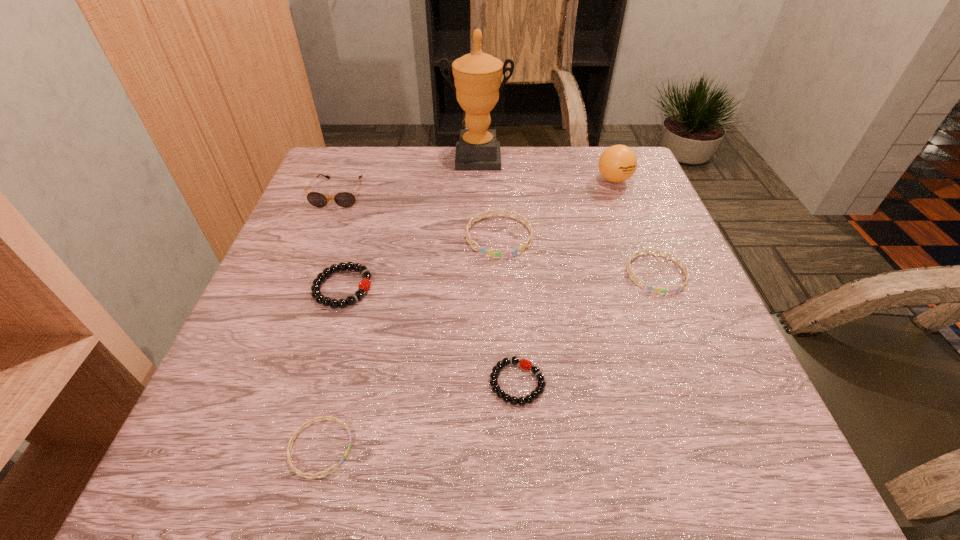
Locate an element on the screen. The width and height of the screenshot is (960, 540). vacant area between the bigger black bracelet and the tallest object is located at coordinates (410, 223).

Where is `empty space that is in between the second blue bracelet from left to right and the fourth farthest bracelet`? The width and height of the screenshot is (960, 540). empty space that is in between the second blue bracelet from left to right and the fourth farthest bracelet is located at coordinates (508, 309).

The height and width of the screenshot is (540, 960). What are the coordinates of `free space between the bigger black bracelet and the ping-pong ball` in the screenshot? It's located at (478, 234).

Locate an element on the screen. vacant point located between the right black bracelet and the black sunglasses is located at coordinates (428, 288).

Image resolution: width=960 pixels, height=540 pixels. What are the coordinates of `vacant space that is in between the second blue bracelet from left to right and the ping-pong ball` in the screenshot? It's located at (557, 208).

This screenshot has width=960, height=540. What are the coordinates of `vacant space that's between the nearer black bracelet and the nearest object` in the screenshot? It's located at (419, 415).

Locate an element on the screen. vacant area between the second blue bracelet from right to left and the sixth shortest object is located at coordinates point(420,214).

What are the coordinates of `free space between the smaller black bracelet and the second blue bracelet from right to left` in the screenshot? It's located at (508, 309).

The image size is (960, 540). What are the coordinates of `empty location between the seventh shortest object and the black sunglasses` in the screenshot? It's located at (476, 186).

Identify which object is the sixth nearest to the golden award. Please provide its 2D coordinates. Your answer should be formatted as a tuple, i.e. [(x, y)], where the tuple contains the x and y coordinates of a point satisfying the conditions above.

[(500, 393)]